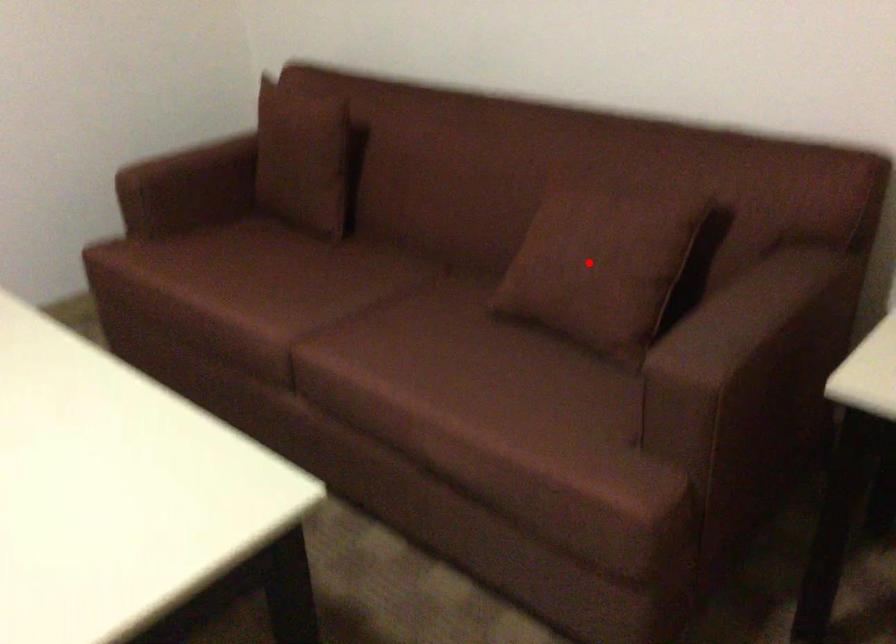
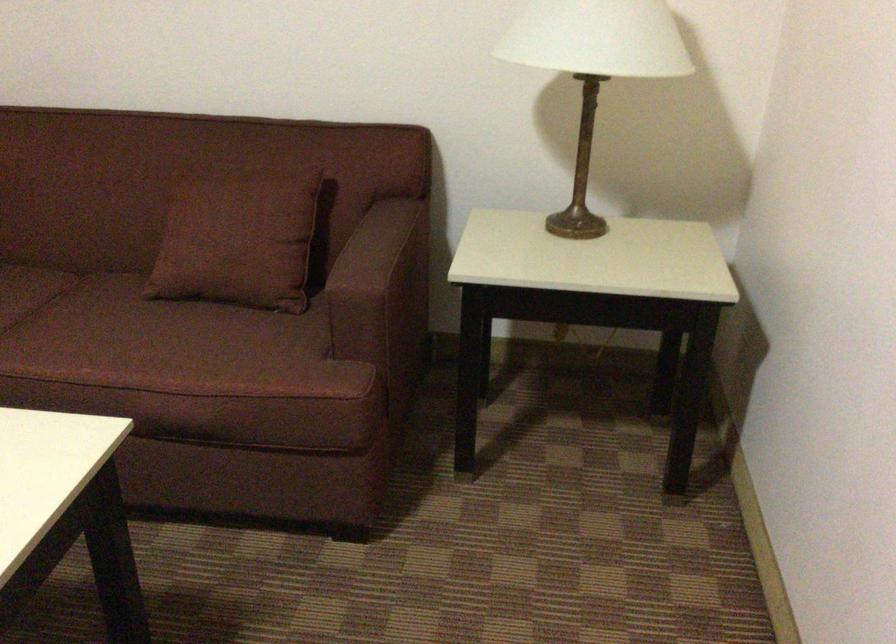
The point at the highlighted location is marked in the first image. Where is the corresponding point in the second image?

(238, 234)